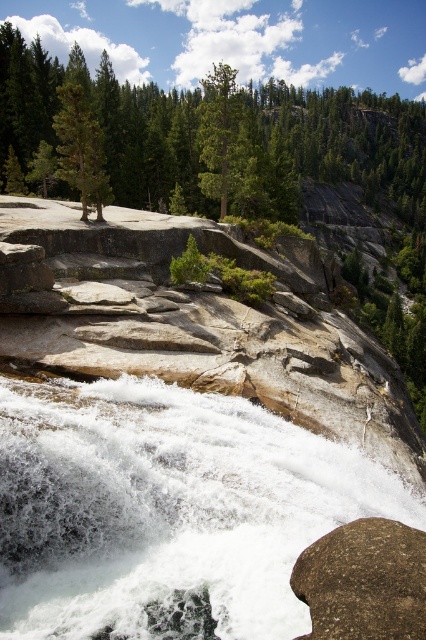
Can you confirm if brown rough rock at lower right is wider than green matte tree at left?

→ Incorrect, brown rough rock at lower right's width does not surpass green matte tree at left's.

Measure the distance between brown rough rock at lower right and camera.

brown rough rock at lower right and camera are 6.98 meters apart from each other.

Locate an element on the screen. brown rough rock at lower right is located at coordinates (363, 580).

What do you see at coordinates (166, 512) in the screenshot?
I see `white frothy water at center` at bounding box center [166, 512].

Does white frothy water at center appear on the right side of green matte tree at upper center?

Correct, you'll find white frothy water at center to the right of green matte tree at upper center.

At what (x,y) coordinates should I click in order to perform the action: click on white frothy water at center. Please return your answer as a coordinate pair (x, y). Image resolution: width=426 pixels, height=640 pixels. Looking at the image, I should click on (166, 512).

Can you confirm if green matte tree at upper left is positioned below brown rough rock at lower right?

Incorrect, green matte tree at upper left is not positioned below brown rough rock at lower right.

Can you confirm if green matte tree at upper left is wider than brown rough rock at lower right?

Yes, green matte tree at upper left is wider than brown rough rock at lower right.

This screenshot has width=426, height=640. What do you see at coordinates (218, 136) in the screenshot? I see `green matte tree at upper left` at bounding box center [218, 136].

Locate an element on the screen. green matte tree at upper left is located at coordinates (218, 136).